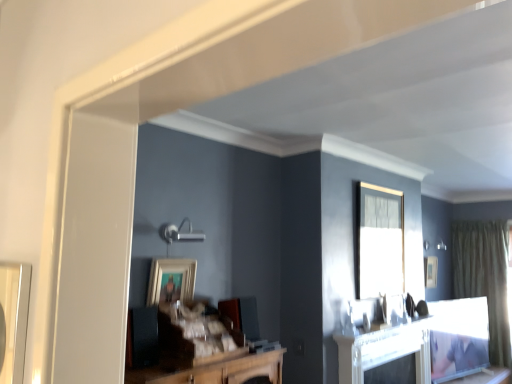
Question: From the image's perspective, is clear glass window at upper center under matte black picture frame at upper right, which is counted as the 2th picture frame, starting from the front?

Choices:
 (A) no
 (B) yes

Answer: (A)

Question: Is clear glass window at upper center smaller than matte black picture frame at upper right, which is counted as the 2th picture frame, starting from the front?

Choices:
 (A) yes
 (B) no

Answer: (B)

Question: Does clear glass window at upper center contain matte black picture frame at upper right, which is counted as the 2th picture frame, starting from the top?

Choices:
 (A) yes
 (B) no

Answer: (B)

Question: Does clear glass window at upper center lie behind matte black picture frame at upper right, positioned as the 1th picture frame in right-to-left order?

Choices:
 (A) yes
 (B) no

Answer: (B)

Question: Is clear glass window at upper center positioned before matte black picture frame at upper right, positioned as the 1th picture frame in right-to-left order?

Choices:
 (A) no
 (B) yes

Answer: (B)

Question: From the image's perspective, is green textured curtain at right above or below clear glass window at upper center?

Choices:
 (A) above
 (B) below

Answer: (B)

Question: Does point (452, 228) appear closer or farther from the camera than point (372, 261)?

Choices:
 (A) closer
 (B) farther

Answer: (B)

Question: From a real-world perspective, relative to clear glass window at upper center, is green textured curtain at right vertically above or below?

Choices:
 (A) above
 (B) below

Answer: (B)

Question: Is green textured curtain at right wider or thinner than clear glass window at upper center?

Choices:
 (A) thin
 (B) wide

Answer: (B)

Question: From a real-world perspective, is clear glass window at upper center physically located above or below wooden table at lower right?

Choices:
 (A) above
 (B) below

Answer: (A)

Question: From the image's perspective, is clear glass window at upper center located above or below wooden table at lower right?

Choices:
 (A) above
 (B) below

Answer: (A)

Question: Visually, is clear glass window at upper center positioned to the left or to the right of wooden table at lower right?

Choices:
 (A) right
 (B) left

Answer: (B)

Question: In terms of width, does clear glass window at upper center look wider or thinner when compared to wooden table at lower right?

Choices:
 (A) wide
 (B) thin

Answer: (B)

Question: Which is correct: clear glass window at upper center is inside white glossy fireplace at center, or outside of it?

Choices:
 (A) outside
 (B) inside

Answer: (A)

Question: From the image's perspective, relative to white glossy fireplace at center, is clear glass window at upper center above or below?

Choices:
 (A) above
 (B) below

Answer: (A)